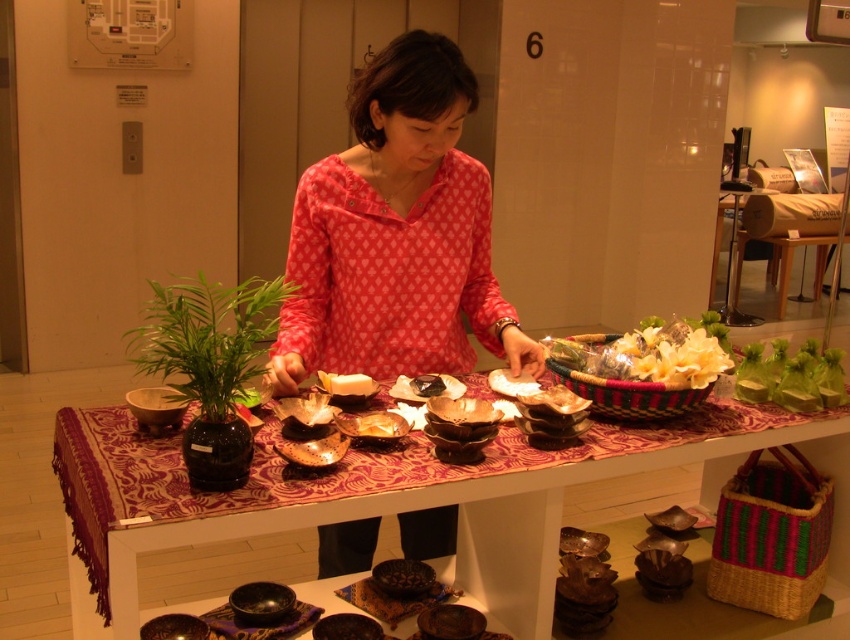
Consider the image. Between pink printed blouse at center and white glossy plate at center, which one appears on the right side from the viewer's perspective?

pink printed blouse at center

Who is more forward, (x=425, y=344) or (x=374, y=420)?

Point (x=374, y=420)

At what (x,y) coordinates should I click in order to perform the action: click on pink printed blouse at center. Please return your answer as a coordinate pair (x, y). Looking at the image, I should click on (395, 234).

Does wooden table at center have a larger size compared to white creamy cheese at center?

Correct, wooden table at center is larger in size than white creamy cheese at center.

Is wooden table at center to the right of white creamy cheese at center from the viewer's perspective?

Indeed, wooden table at center is positioned on the right side of white creamy cheese at center.

The width and height of the screenshot is (850, 640). Describe the element at coordinates (367, 499) in the screenshot. I see `wooden table at center` at that location.

Where is `wooden table at center`? wooden table at center is located at coordinates (367, 499).

Is point (633, 349) closer to viewer compared to point (388, 412)?

No, (633, 349) is behind (388, 412).

Does floral-patterned fabric basket at center appear on the right side of white glossy plate at center?

Indeed, floral-patterned fabric basket at center is positioned on the right side of white glossy plate at center.

Locate an element on the screen. The height and width of the screenshot is (640, 850). floral-patterned fabric basket at center is located at coordinates (647, 355).

The image size is (850, 640). What are the coordinates of `floral-patterned fabric basket at center` in the screenshot? It's located at (647, 355).